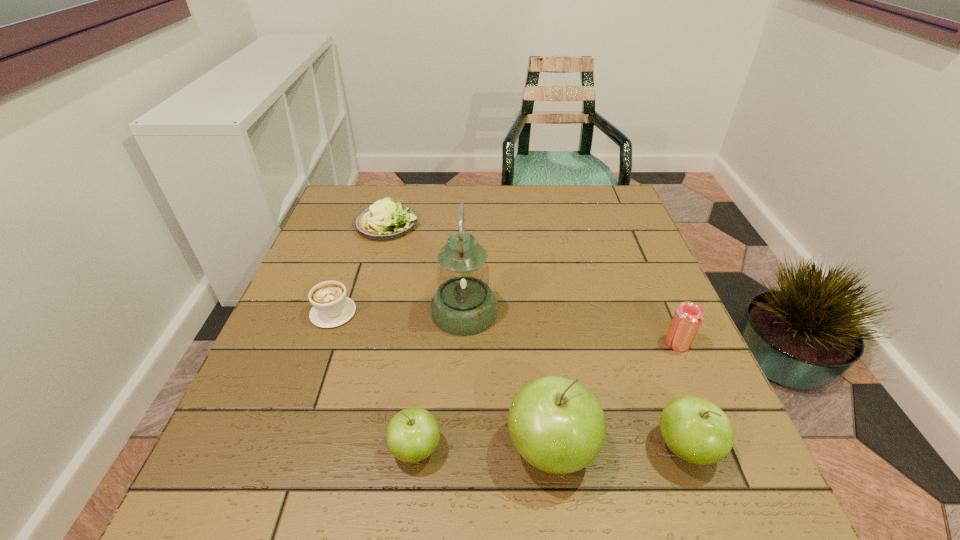
All apples are currently evenly spaced. To continue this pattern, where would you add another apple on the left? Please point out a vacant spot. Please provide its 2D coordinates. Your answer should be formatted as a tuple, i.e. [(x, y)], where the tuple contains the x and y coordinates of a point satisfying the conditions above.

[(279, 449)]